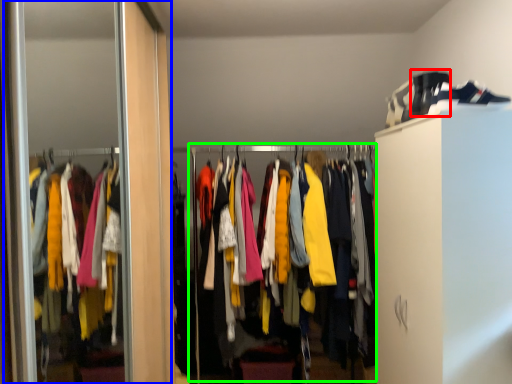
Question: Which object is positioned farthest from shoe (highlighted by a red box)? Select from screen door (highlighted by a blue box) and closet (highlighted by a green box).

Choices:
 (A) screen door
 (B) closet

Answer: (A)